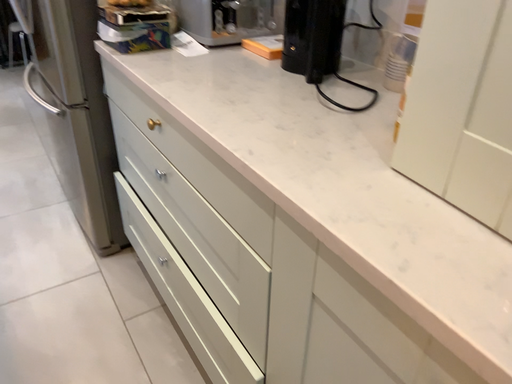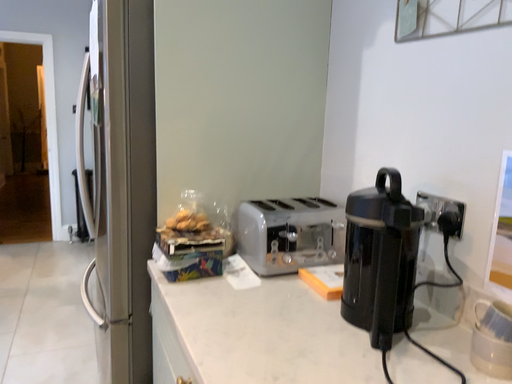
Question: How did the camera likely rotate when shooting the video?

Choices:
 (A) rotated downward
 (B) rotated upward

Answer: (B)